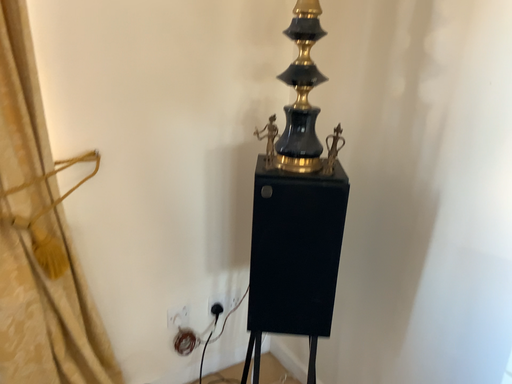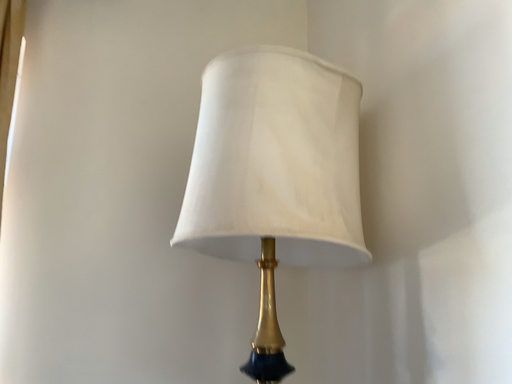
Question: Which way did the camera rotate in the video?

Choices:
 (A) rotated left
 (B) rotated right

Answer: (A)